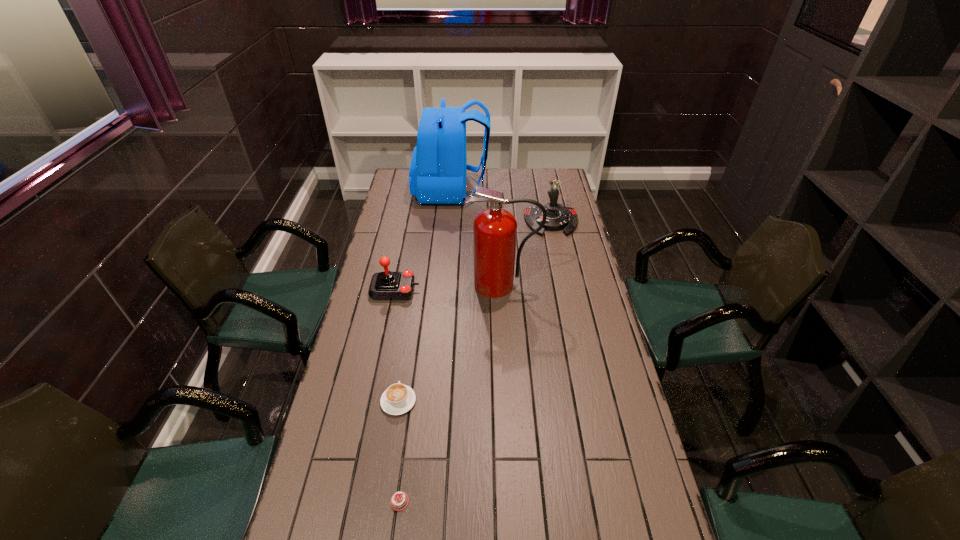
This screenshot has width=960, height=540. What are the coordinates of `free spot between the fire extinguisher and the left joystick` in the screenshot? It's located at (449, 287).

Where is `free point between the second shortest object and the fire extinguisher`? free point between the second shortest object and the fire extinguisher is located at coordinates (450, 343).

Identify the location of empty space between the second nearest object and the backpack. (425, 296).

In order to click on vacant space in between the farther joystick and the nearest object in this screenshot , I will do `click(475, 362)`.

Where is `free space between the fire extinguisher and the cappuccino`? The image size is (960, 540). free space between the fire extinguisher and the cappuccino is located at coordinates (450, 343).

The width and height of the screenshot is (960, 540). What are the coordinates of `vacant space that is in between the second shortest object and the left joystick` in the screenshot? It's located at (396, 345).

Locate which object is the third closest to the backpack. Please provide its 2D coordinates. Your answer should be formatted as a tuple, i.e. [(x, y)], where the tuple contains the x and y coordinates of a point satisfying the conditions above.

[(387, 285)]

At what (x,y) coordinates should I click in order to perform the action: click on object that is the fourth nearest to the backpack. Please return your answer as a coordinate pair (x, y). The width and height of the screenshot is (960, 540). Looking at the image, I should click on (397, 399).

Identify the location of blank space that satisfies the following two spatial constraints: 1. on the base of the fourth tallest object; 2. on the side of the second shortest object with the handle. The width and height of the screenshot is (960, 540). (372, 401).